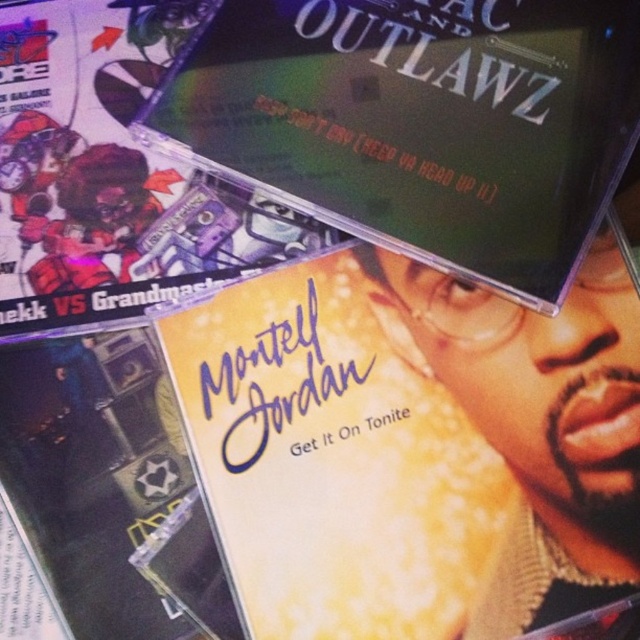
Question: Which point appears farthest from the camera in this image?

Choices:
 (A) (458, 54)
 (B) (96, 129)

Answer: (B)

Question: Among these points, which one is farthest from the camera?

Choices:
 (A) (113, 312)
 (B) (408, 184)

Answer: (B)

Question: Is matte plastic cd at upper center closer to camera compared to matte black cd at upper left?

Choices:
 (A) yes
 (B) no

Answer: (A)

Question: Which object appears closest to the camera in this image?

Choices:
 (A) matte plastic cd at upper center
 (B) matte black cd at upper left

Answer: (A)

Question: Is matte plastic cd at upper center wider than matte black cd at upper left?

Choices:
 (A) yes
 (B) no

Answer: (A)

Question: From the image, what is the correct spatial relationship of matte plastic cd at upper center in relation to matte black cd at upper left?

Choices:
 (A) right
 (B) left

Answer: (A)